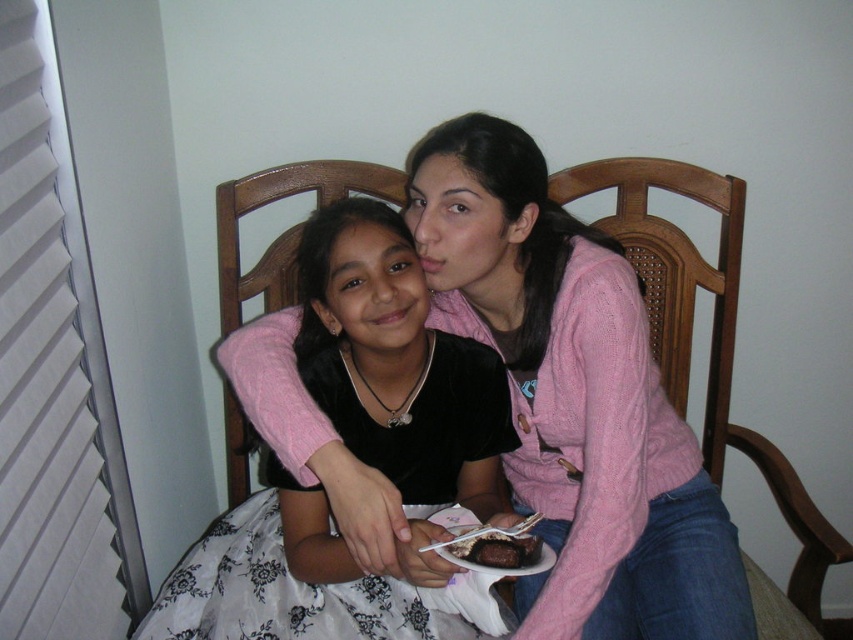
Can you confirm if wooden chair at center is positioned above chocolate cake at center?

Indeed, wooden chair at center is positioned over chocolate cake at center.

Which is below, wooden chair at center or chocolate cake at center?

Positioned lower is chocolate cake at center.

Locate an element on the screen. Image resolution: width=853 pixels, height=640 pixels. wooden chair at center is located at coordinates (717, 355).

Identify the location of wooden chair at center. click(x=717, y=355).

Is the position of black velvet dress at center less distant than that of chocolate cake at center?

No, it is not.

Looking at this image, which is below, black velvet dress at center or chocolate cake at center?

chocolate cake at center is below.

Is point (207, 595) more distant than point (505, 548)?

Yes, point (207, 595) is behind point (505, 548).

You are a GUI agent. You are given a task and a screenshot of the screen. Output one action in this format:
    pyautogui.click(x=<x>, y=<y>)
    Task: Click on the black velvet dress at center
    The image size is (853, 640).
    Given the screenshot: What is the action you would take?
    pyautogui.click(x=352, y=454)

Is point (322, 252) positioned after point (724, 193)?

No, (322, 252) is in front of (724, 193).

Between black velvet dress at center and wooden chair at center, which one is positioned lower?

black velvet dress at center is below.

Is point (495, 452) behind point (721, 237)?

No.

Identify the location of black velvet dress at center. The image size is (853, 640). (352, 454).